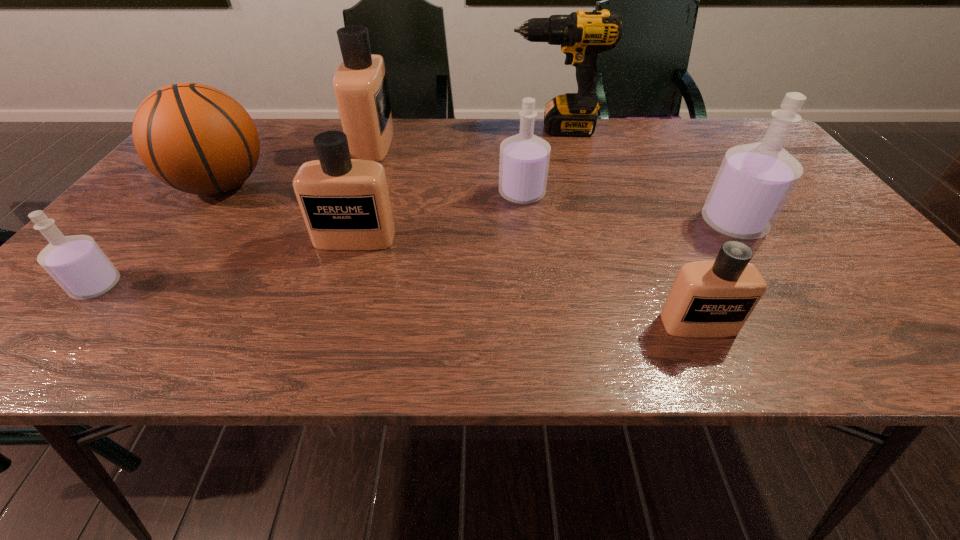
Find the location of a particular element. Image resolution: width=960 pixels, height=540 pixels. blank area in the image that satisfies the following two spatial constraints: 1. on the front label of the second biggest purple perfume; 2. on the right side of the farthest beige perfume is located at coordinates (355, 193).

Find the location of a particular element. vacant point that satisfies the following two spatial constraints: 1. on the front label of the rightmost object; 2. on the right side of the biggest beige perfume is located at coordinates (345, 224).